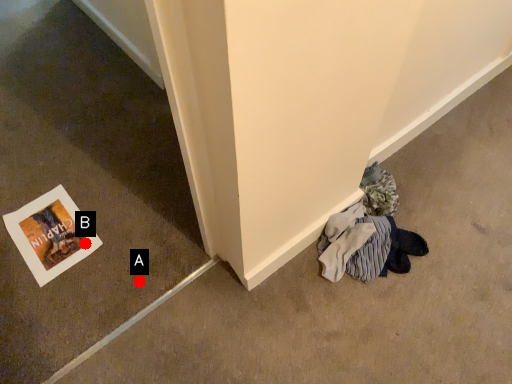
Question: Two points are circled on the image, labeled by A and B beside each circle. Which point is further to the camera?

Choices:
 (A) A is further
 (B) B is further

Answer: (B)